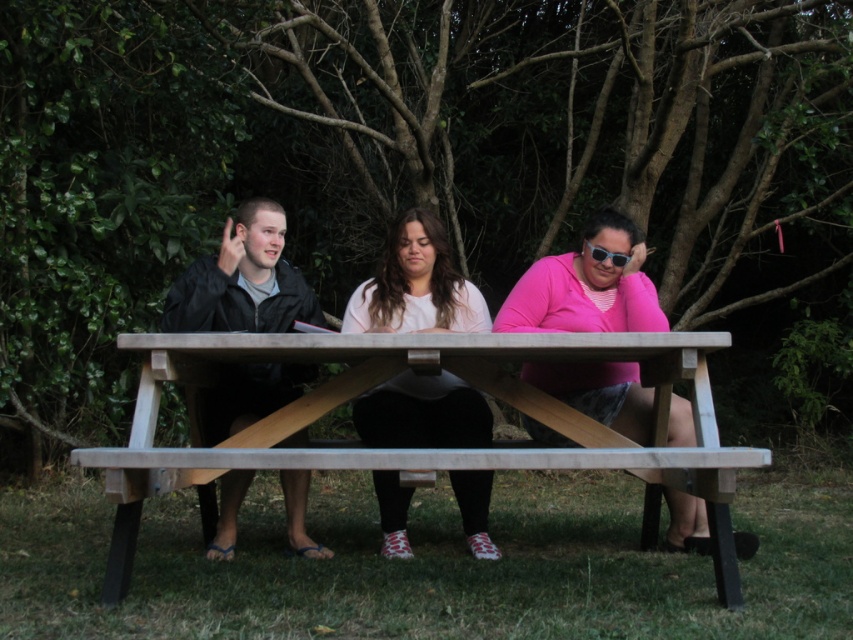
Question: Can you confirm if natural wood picnic table at center is positioned to the right of black matte jacket at left?

Choices:
 (A) yes
 (B) no

Answer: (A)

Question: Which point appears closest to the camera in this image?

Choices:
 (A) (601, 259)
 (B) (651, 312)
 (C) (456, 408)

Answer: (B)

Question: Which of these objects is positioned closest to the matte black jacket at left?

Choices:
 (A) pink matte shirt at center
 (B) black matte jacket at left
 (C) natural wood picnic table at center
 (D) sunglasses at center

Answer: (D)

Question: Does natural wood picnic table at center have a larger size compared to black matte jacket at left?

Choices:
 (A) yes
 (B) no

Answer: (A)

Question: Does natural wood picnic table at center have a greater width compared to sunglasses at center?

Choices:
 (A) yes
 (B) no

Answer: (A)

Question: Estimate the real-world distances between objects in this image. Which object is closer to the natural wood picnic table at center?

Choices:
 (A) pink matte shirt at center
 (B) sunglasses at center
 (C) black matte jacket at left

Answer: (A)